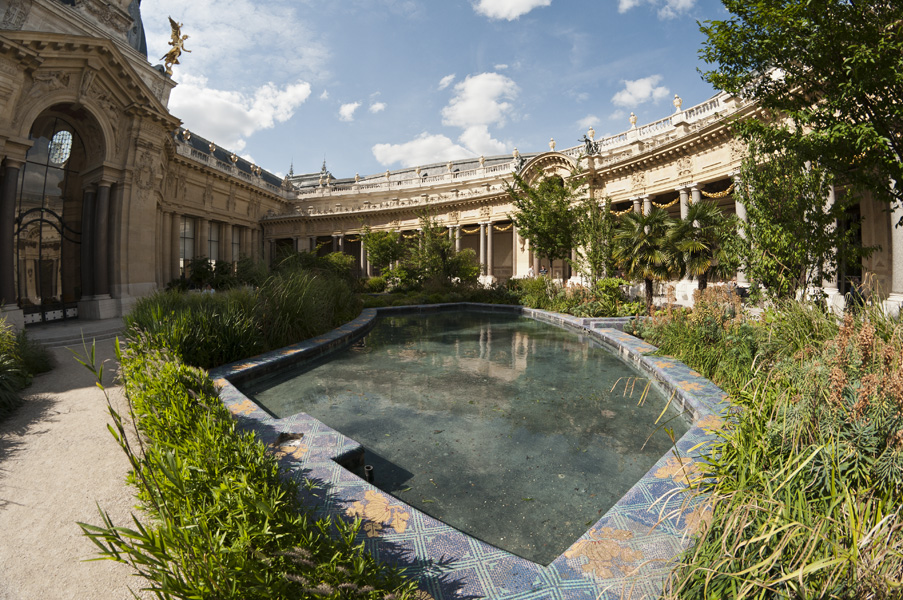
At what (x,y) coordinates should I click in order to perform the action: click on statue. Please return your answer as a coordinate pair (x, y). The image size is (903, 600). Looking at the image, I should click on (180, 49).